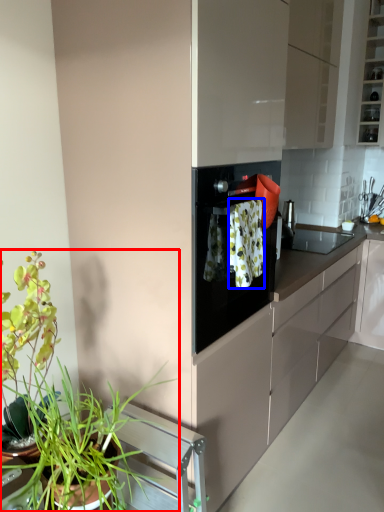
Question: Which object appears closest to the camera in this image, houseplant (highlighted by a red box) or laundry (highlighted by a blue box)?

Choices:
 (A) houseplant
 (B) laundry

Answer: (A)